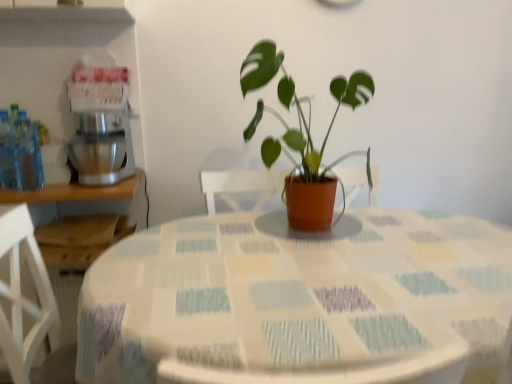
Image resolution: width=512 pixels, height=384 pixels. I want to click on unoccupied area in front of matte terracotta pot at center, so click(336, 256).